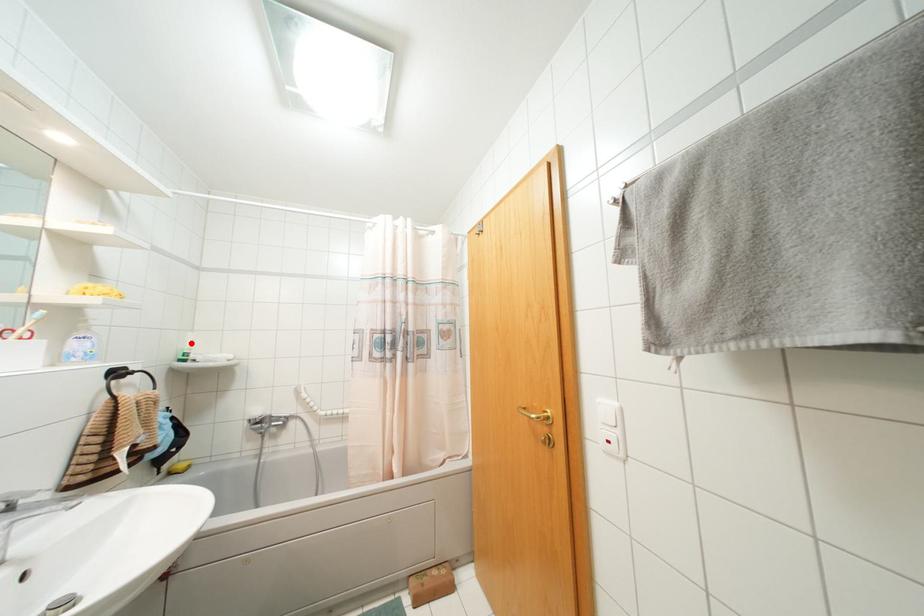
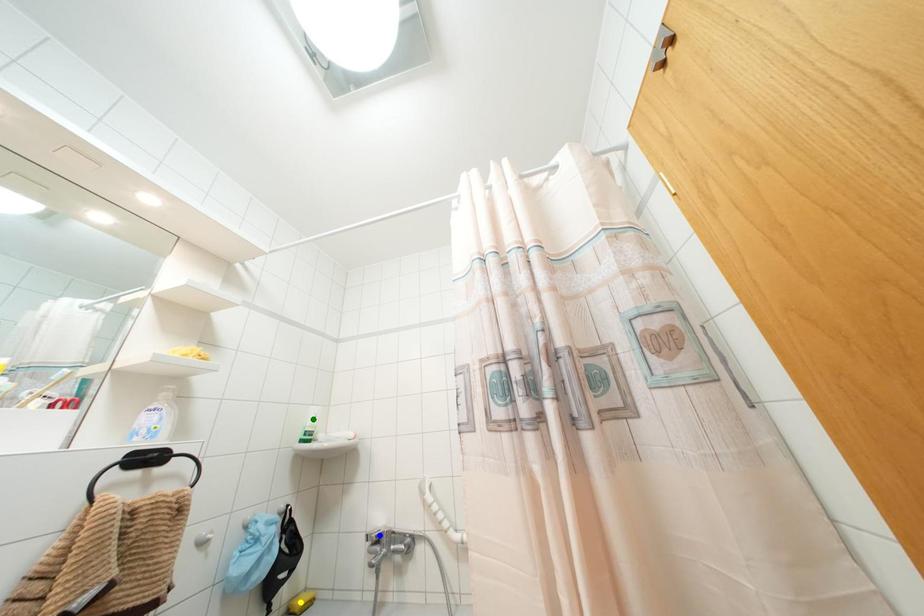
Question: I am providing you with two images of the same scene from different viewpoints. A red point is marked on the first image. You are given multiple points on the second image. Which point in image 2 represents the same 3d spot as the red point in image 1?

Choices:
 (A) blue point
 (B) yellow point
 (C) green point

Answer: (C)